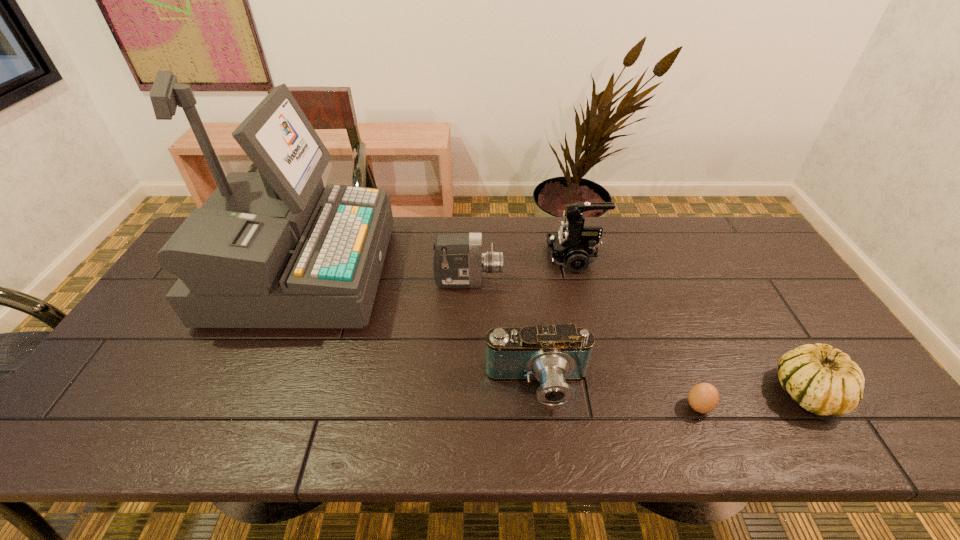
This screenshot has height=540, width=960. What are the coordinates of `the tallest object` in the screenshot? It's located at (271, 249).

Where is `the leftmost object`? Image resolution: width=960 pixels, height=540 pixels. the leftmost object is located at coordinates (271, 249).

This screenshot has height=540, width=960. Identify the location of the fifth shortest object. (574, 246).

Where is `the nearest camcorder`? the nearest camcorder is located at coordinates (553, 354).

The width and height of the screenshot is (960, 540). I want to click on gourd, so [823, 380].

In order to click on the shortest object in this screenshot , I will do `click(704, 397)`.

This screenshot has width=960, height=540. Identify the location of the fifth object from left to right. click(x=704, y=397).

Find the location of a particular element. This screenshot has height=540, width=960. vacant space located 0.280m on the customer-facing side of the cash register is located at coordinates (475, 273).

The image size is (960, 540). In order to click on vacant space located 0.050m on the lens mount of the tallest camcorder in this screenshot , I will do `click(532, 258)`.

The height and width of the screenshot is (540, 960). In order to click on blank area located 0.130m on the lens mount of the tallest camcorder in this screenshot , I will do `click(507, 258)`.